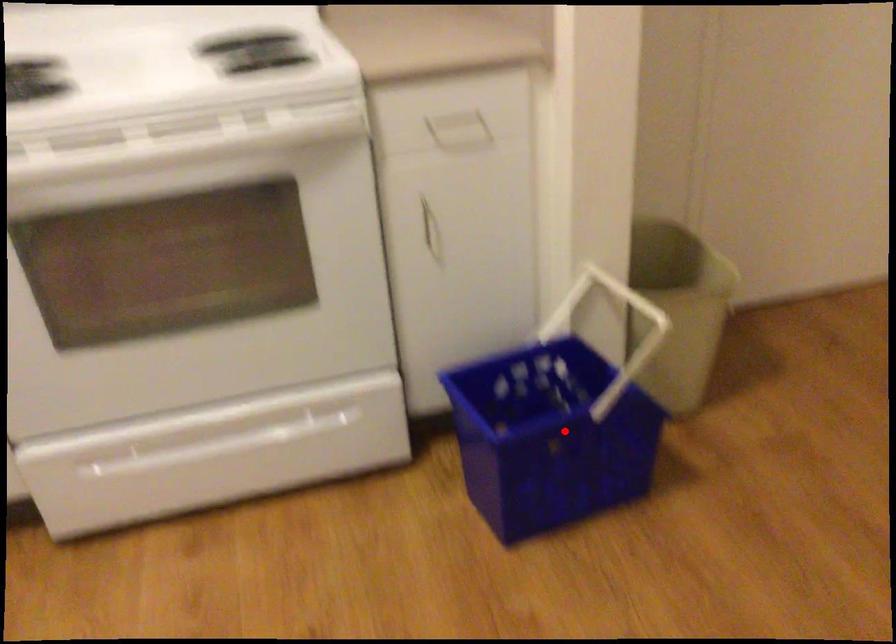
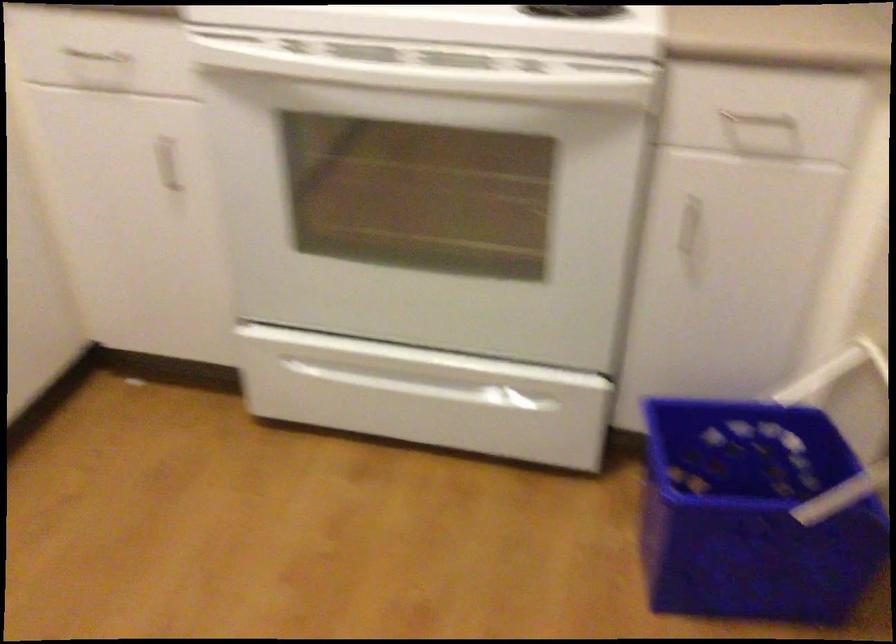
Question: I am providing you with two images of the same scene from different viewpoints. In image1, a red point is highlighted. Considering the same 3D point in image2, which of the following is correct?

Choices:
 (A) It is closer
 (B) It is farther

Answer: (A)